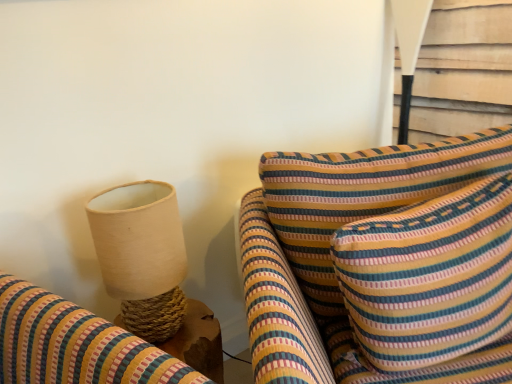
Question: From a real-world perspective, is striped fabric cushion at center below white fabric lampshade at upper right, the 2th table lamp positioned from the left?

Choices:
 (A) no
 (B) yes

Answer: (B)

Question: Is striped fabric cushion at center turned away from white fabric lampshade at upper right, the 2th table lamp positioned from the left?

Choices:
 (A) no
 (B) yes

Answer: (B)

Question: Is striped fabric cushion at center behind white fabric lampshade at upper right, the 2th table lamp positioned from the left?

Choices:
 (A) yes
 (B) no

Answer: (B)

Question: Can you confirm if striped fabric cushion at center is taller than white fabric lampshade at upper right, the 2th table lamp positioned from the left?

Choices:
 (A) yes
 (B) no

Answer: (A)

Question: From a real-world perspective, is striped fabric cushion at center on white fabric lampshade at upper right, which appears as the first table lamp when viewed from the back?

Choices:
 (A) yes
 (B) no

Answer: (B)

Question: Are striped fabric cushion at center and white fabric lampshade at upper right, which appears as the first table lamp when viewed from the back, located far from each other?

Choices:
 (A) yes
 (B) no

Answer: (B)

Question: Can you confirm if white fabric lampshade at upper right, acting as the first table lamp starting from the top, is positioned to the right of natural woven lampshade at left, which appears as the 2th table lamp when viewed from the back?

Choices:
 (A) yes
 (B) no

Answer: (A)

Question: Is white fabric lampshade at upper right, which appears as the first table lamp when viewed from the back, directly adjacent to natural woven lampshade at left, acting as the first table lamp starting from the front?

Choices:
 (A) yes
 (B) no

Answer: (B)

Question: From the image's perspective, is white fabric lampshade at upper right, which appears as the first table lamp when viewed from the back, on natural woven lampshade at left, acting as the first table lamp starting from the front?

Choices:
 (A) yes
 (B) no

Answer: (A)

Question: Can we say white fabric lampshade at upper right, the 1th table lamp in the right-to-left sequence, lies outside natural woven lampshade at left, positioned as the 1th table lamp in bottom-to-top order?

Choices:
 (A) yes
 (B) no

Answer: (A)

Question: Would you consider white fabric lampshade at upper right, positioned as the 2th table lamp in front-to-back order, to be distant from natural woven lampshade at left, positioned as the 1th table lamp in bottom-to-top order?

Choices:
 (A) no
 (B) yes

Answer: (B)

Question: From a real-world perspective, is white fabric lampshade at upper right, the 2th table lamp positioned from the left, on natural woven lampshade at left, the 1th table lamp positioned from the left?

Choices:
 (A) no
 (B) yes

Answer: (B)

Question: From a real-world perspective, is striped fabric cushion at center beneath natural woven lampshade at left, the second table lamp when ordered from right to left?

Choices:
 (A) no
 (B) yes

Answer: (B)